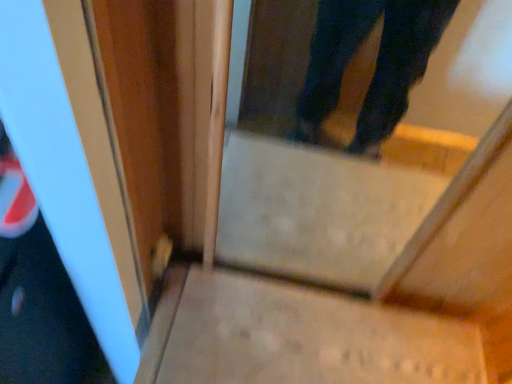
Measure the distance between matte plastic door handle at lower left and camera.

A distance of 33.88 inches exists between matte plastic door handle at lower left and camera.

You are a GUI agent. You are given a task and a screenshot of the screen. Output one action in this format:
    pyautogui.click(x=<x>, y=<y>)
    Task: Click on the matte plastic door handle at lower left
    
    Given the screenshot: What is the action you would take?
    pyautogui.click(x=161, y=256)

The image size is (512, 384). What do you see at coordinates (161, 256) in the screenshot?
I see `matte plastic door handle at lower left` at bounding box center [161, 256].

Where is `matte plastic door handle at lower left`? The image size is (512, 384). matte plastic door handle at lower left is located at coordinates [161, 256].